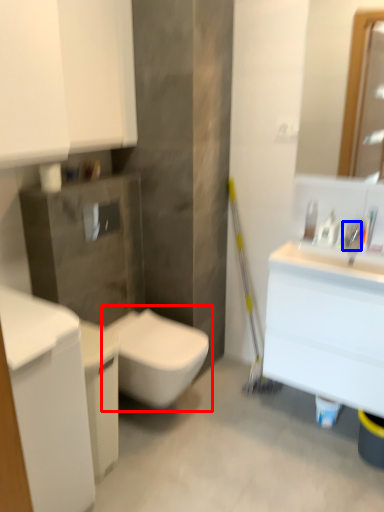
Question: Which point is closer to the camera, toilet (highlighted by a red box) or faucet (highlighted by a blue box)?

Choices:
 (A) toilet
 (B) faucet

Answer: (A)